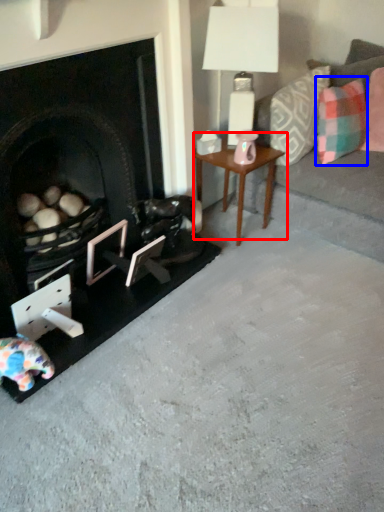
Question: Which object is closer to the camera taking this photo, table (highlighted by a red box) or pillow (highlighted by a blue box)?

Choices:
 (A) table
 (B) pillow

Answer: (B)